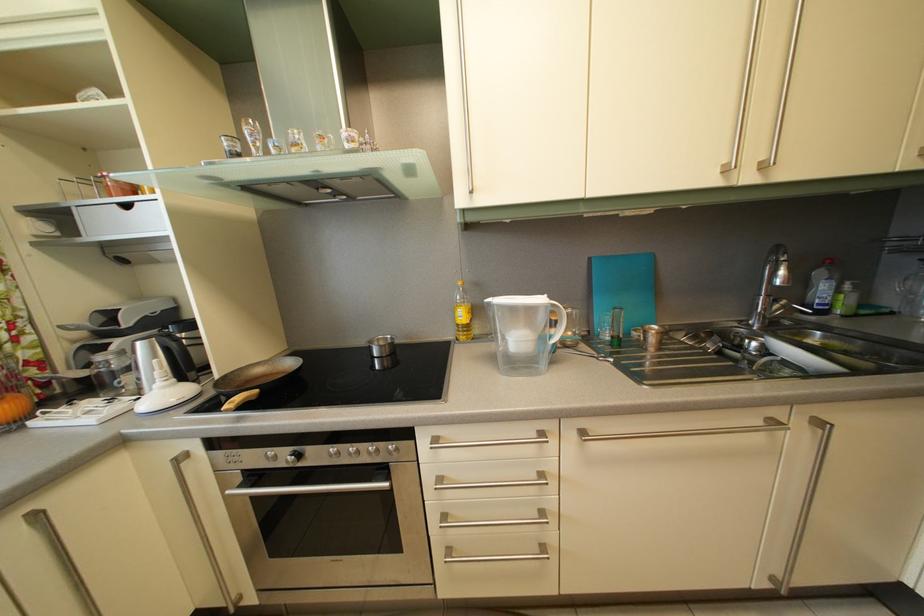
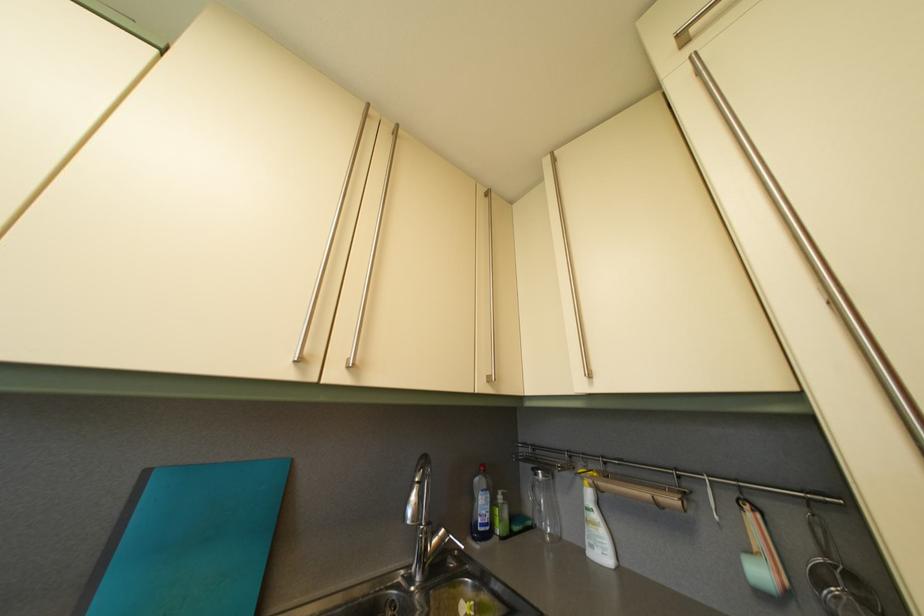
First-person continuous shooting, in which direction is the camera rotating?

The camera's rotation is toward right-up.